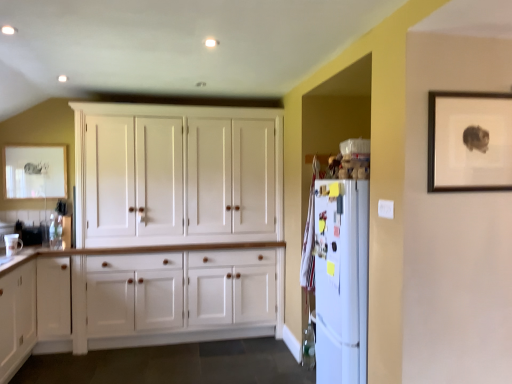
Question: From the image's perspective, is wooden picture frame at upper right, which is counted as the 2th picture frame, starting from the left, on top of white wood cabinet at lower left?

Choices:
 (A) yes
 (B) no

Answer: (A)

Question: Is wooden picture frame at upper right, marked as the 1th picture frame in a front-to-back arrangement, wider than white wood cabinet at lower left?

Choices:
 (A) no
 (B) yes

Answer: (A)

Question: Is wooden picture frame at upper right, marked as the 1th picture frame in a front-to-back arrangement, touching white wood cabinet at lower left?

Choices:
 (A) no
 (B) yes

Answer: (A)

Question: Does wooden picture frame at upper right, which is counted as the 2th picture frame, starting from the left, turn towards white wood cabinet at lower left?

Choices:
 (A) yes
 (B) no

Answer: (B)

Question: Is the depth of wooden picture frame at upper right, which is counted as the 2th picture frame, starting from the left, less than that of white wood cabinet at lower left?

Choices:
 (A) no
 (B) yes

Answer: (B)

Question: In terms of size, does matte white picture frame at upper left, the second picture frame in the right-to-left sequence, appear bigger or smaller than wooden picture frame at upper right, the 1th picture frame from the right?

Choices:
 (A) small
 (B) big

Answer: (B)

Question: Is matte white picture frame at upper left, the second picture frame viewed from the front, wider or thinner than wooden picture frame at upper right, marked as the 1th picture frame in a front-to-back arrangement?

Choices:
 (A) wide
 (B) thin

Answer: (A)

Question: Is matte white picture frame at upper left, which is counted as the first picture frame, starting from the back, in front of or behind wooden picture frame at upper right, which is counted as the 2th picture frame, starting from the left, in the image?

Choices:
 (A) behind
 (B) front

Answer: (A)

Question: Choose the correct answer: Is matte white picture frame at upper left, the second picture frame in the right-to-left sequence, inside wooden picture frame at upper right, which is counted as the 2th picture frame, starting from the left, or outside it?

Choices:
 (A) outside
 (B) inside

Answer: (A)

Question: Would you say white matte refrigerator at right is to the left or to the right of white glossy mug at lower left in the picture?

Choices:
 (A) left
 (B) right

Answer: (B)

Question: From a real-world perspective, is white matte refrigerator at right above or below white glossy mug at lower left?

Choices:
 (A) above
 (B) below

Answer: (B)

Question: Looking at the image, does white matte refrigerator at right seem bigger or smaller compared to white glossy mug at lower left?

Choices:
 (A) big
 (B) small

Answer: (A)

Question: Is white matte refrigerator at right taller or shorter than white glossy mug at lower left?

Choices:
 (A) short
 (B) tall

Answer: (B)

Question: Would you say white wood cabinet at lower left is inside or outside white wood cupboard at center?

Choices:
 (A) inside
 (B) outside

Answer: (B)

Question: Looking at the image, does white wood cabinet at lower left seem bigger or smaller compared to white wood cupboard at center?

Choices:
 (A) small
 (B) big

Answer: (A)